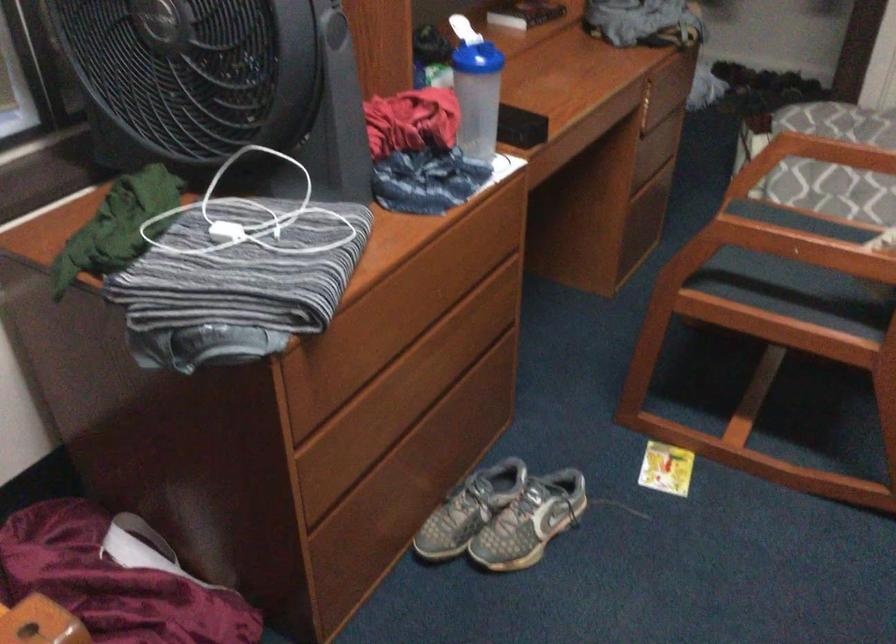
Where is `chair armrest`? This screenshot has height=644, width=896. chair armrest is located at coordinates click(790, 245).